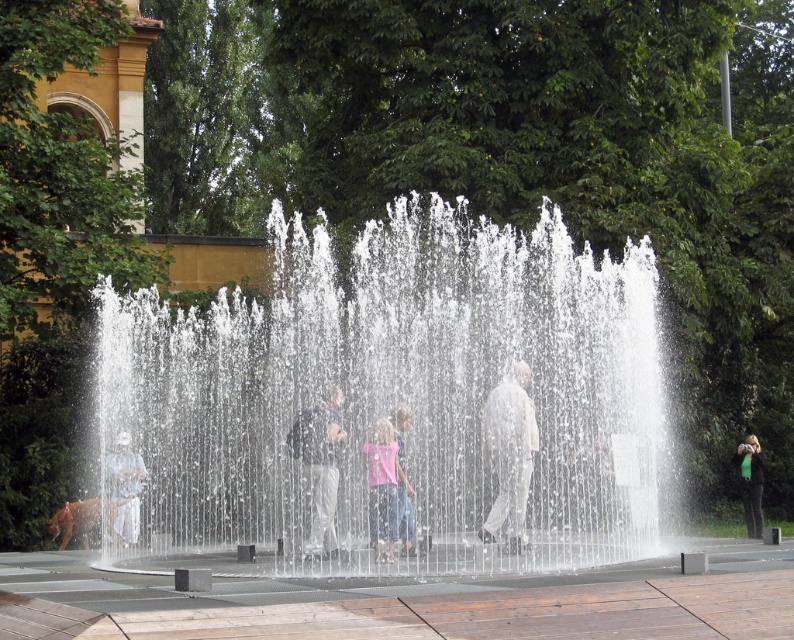
Between white fabric statue at center and pink fabric shirt at center, which one is positioned higher?

pink fabric shirt at center is higher up.

Who is taller, white fabric statue at center or pink fabric shirt at center?

pink fabric shirt at center is taller.

The width and height of the screenshot is (794, 640). Find the location of `white fabric statue at center`. white fabric statue at center is located at coordinates (124, 486).

Is white fabric statue at center above green fabric bag at right?

Yes, white fabric statue at center is above green fabric bag at right.

Does white fabric statue at center have a lesser width compared to green fabric bag at right?

Yes.

Who is more forward, [137,460] or [754,520]?

Point [137,460] is in front.

Locate an element on the screen. The image size is (794, 640). white fabric statue at center is located at coordinates (124, 486).

Can you confirm if white matte coat at center is positioned above light blue jeans at center?

Yes.

Locate an element on the screen. Image resolution: width=794 pixels, height=640 pixels. white matte coat at center is located at coordinates point(509,454).